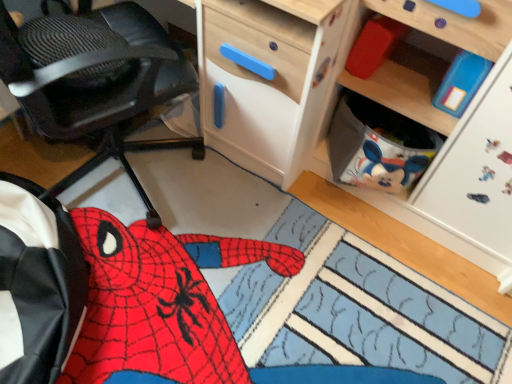
Question: Does matte red block at upper right touch wooden cabinet at upper right?

Choices:
 (A) no
 (B) yes

Answer: (A)

Question: From the image's perspective, is matte red block at upper right below wooden cabinet at upper right?

Choices:
 (A) yes
 (B) no

Answer: (B)

Question: Is matte red block at upper right smaller than wooden cabinet at upper right?

Choices:
 (A) yes
 (B) no

Answer: (A)

Question: From the image's perspective, is matte red block at upper right located above wooden cabinet at upper right?

Choices:
 (A) no
 (B) yes

Answer: (B)

Question: Can you confirm if matte red block at upper right is positioned to the left of wooden cabinet at upper right?

Choices:
 (A) no
 (B) yes

Answer: (B)

Question: Relative to wooden cabinet at upper right, is black textured office chair at left in front or behind?

Choices:
 (A) front
 (B) behind

Answer: (A)

Question: From the image's perspective, is black textured office chair at left located above or below wooden cabinet at upper right?

Choices:
 (A) above
 (B) below

Answer: (A)

Question: From a real-world perspective, is black textured office chair at left positioned above or below wooden cabinet at upper right?

Choices:
 (A) above
 (B) below

Answer: (A)

Question: Considering the relative positions of black textured office chair at left and wooden cabinet at upper right in the image provided, is black textured office chair at left to the left or to the right of wooden cabinet at upper right?

Choices:
 (A) right
 (B) left

Answer: (B)

Question: Based on their sizes in the image, would you say black textured office chair at left is bigger or smaller than matte red block at upper right?

Choices:
 (A) big
 (B) small

Answer: (A)

Question: In terms of width, does black textured office chair at left look wider or thinner when compared to matte red block at upper right?

Choices:
 (A) wide
 (B) thin

Answer: (A)

Question: Is point (110, 129) closer or farther from the camera than point (376, 21)?

Choices:
 (A) farther
 (B) closer

Answer: (A)

Question: From the image's perspective, relative to matte red block at upper right, is black textured office chair at left above or below?

Choices:
 (A) below
 (B) above

Answer: (A)

Question: Is wooden cabinet at upper right wider or thinner than black textured office chair at left?

Choices:
 (A) thin
 (B) wide

Answer: (A)

Question: Is wooden cabinet at upper right to the left or to the right of black textured office chair at left in the image?

Choices:
 (A) left
 (B) right

Answer: (B)